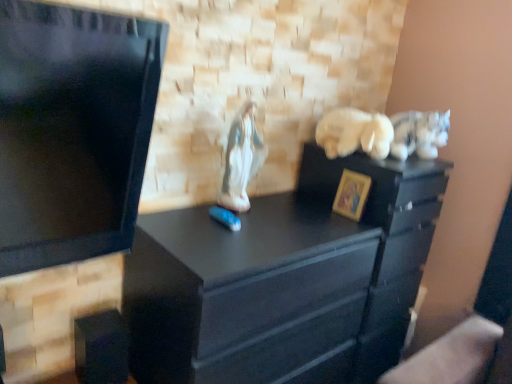
Image resolution: width=512 pixels, height=384 pixels. Identify the location of vacant area that is situated to the right of porcelain statue at center, the first animal viewed from the left. (281, 219).